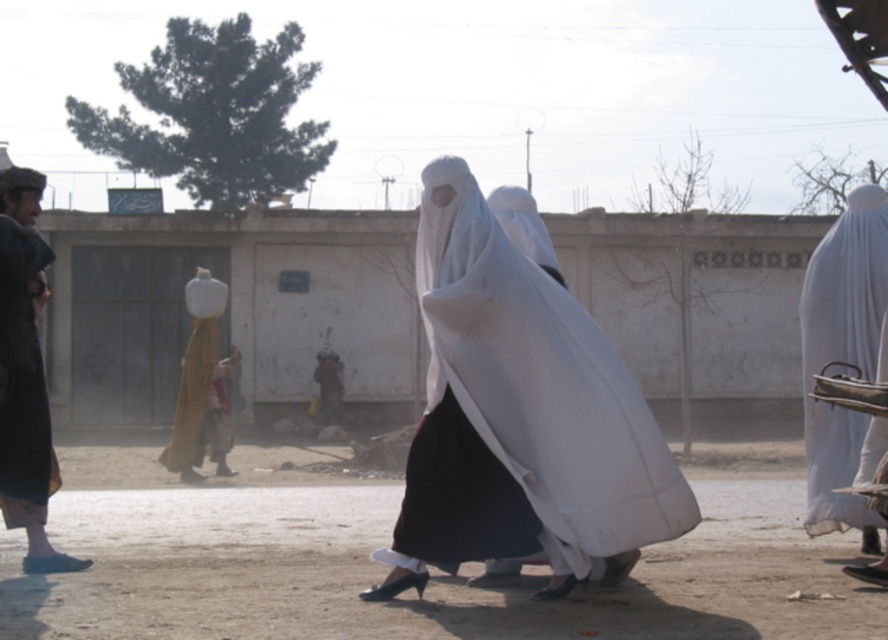
Does point (599, 349) come farther from viewer compared to point (28, 394)?

That is False.

Can you confirm if white sheer veil at center is positioned to the left of dark brown leather jacket at left?

No, white sheer veil at center is not to the left of dark brown leather jacket at left.

Is point (649, 516) closer to camera compared to point (14, 172)?

Yes, point (649, 516) is closer to viewer.

I want to click on white sheer veil at center, so click(540, 381).

Does dirt field at lower center have a larger size compared to white sheer veil at center?

Correct, dirt field at lower center is larger in size than white sheer veil at center.

Image resolution: width=888 pixels, height=640 pixels. What do you see at coordinates (382, 570) in the screenshot?
I see `dirt field at lower center` at bounding box center [382, 570].

Identify the location of dirt field at lower center. (382, 570).

Which is below, white sheer veil at center or white matte burqa at right?

white sheer veil at center

In the scene shown: Who is taller, white sheer veil at center or white matte burqa at right?

With more height is white sheer veil at center.

Which is in front, point (607, 545) or point (878, 225)?

Point (607, 545)

Where is `white sheer veil at center`? white sheer veil at center is located at coordinates (540, 381).